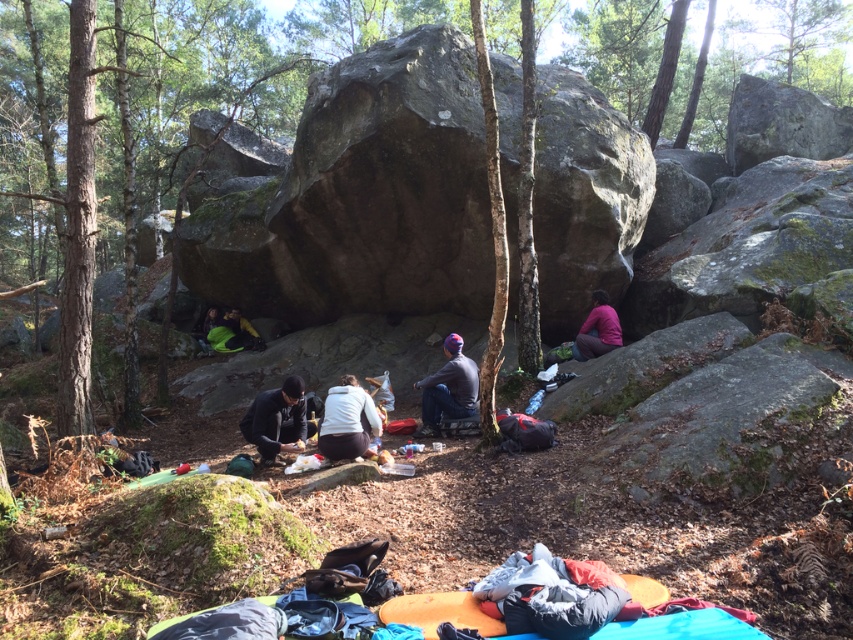
You are planning to take a photo of the black matte jacket at center and the green fabric bag at lower left. Since you want both items to be clearly visible in the photo, which object should you focus on first to ensure proper depth of field?

The black matte jacket at center is in front of the green fabric bag at lower left, so you should focus on the black matte jacket at center first to ensure both are in focus.

You are planning to place a small item on the ground near the black matte jacket at center and the green fabric bag at lower left. Based on their positions, which object is closer to the ground?

The black matte jacket at center is located below green fabric bag at lower left, so the black matte jacket at center is closer to the ground.

From the picture: You are standing in the forest scene and want to place a small flag at one of the two points, point (430, 378) or point (579, 353). If you want the flag to be more visible to someone approaching from the front, which point should you choose?

Point (430, 378) is closer to the viewer than point (579, 353), so placing the flag there would make it more visible to someone approaching from the front.